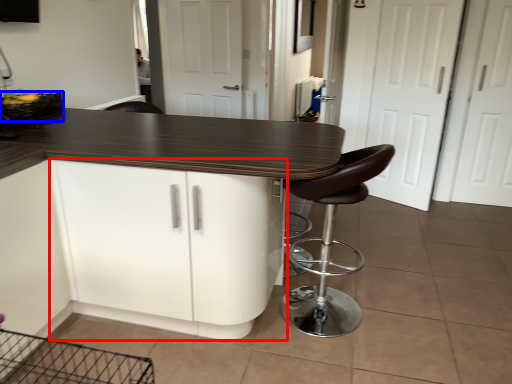
Question: Which of the following is the closest to the observer, cabinetry (highlighted by a red box) or basket (highlighted by a blue box)?

Choices:
 (A) cabinetry
 (B) basket

Answer: (A)